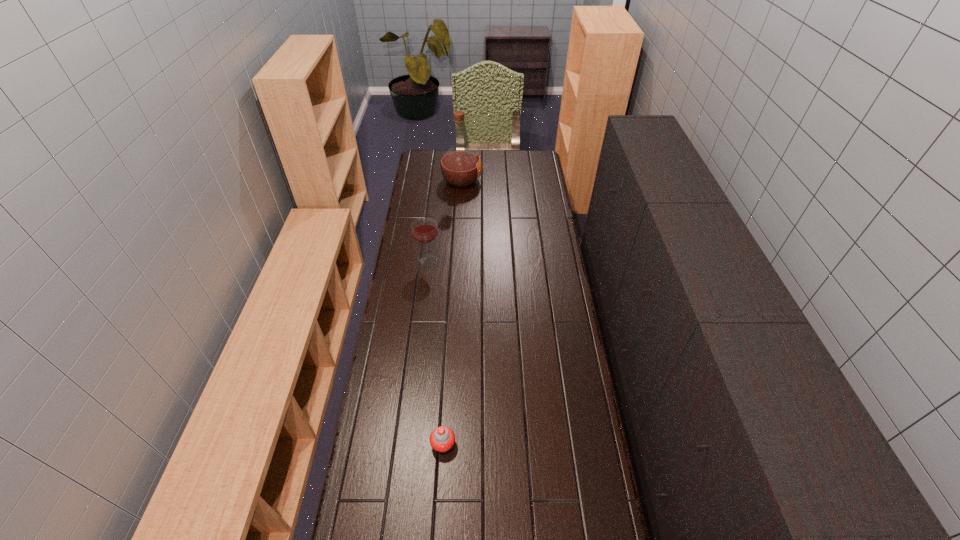
At what (x,y) coordinates should I click in order to perform the action: click on free spot between the nearest object and the liquor. Please return your answer as a coordinate pair (x, y). The width and height of the screenshot is (960, 540). Looking at the image, I should click on point(452,312).

Locate an element on the screen. This screenshot has height=540, width=960. free space between the wineglass and the tallest object is located at coordinates (444, 220).

This screenshot has width=960, height=540. I want to click on vacant region between the second nearest object and the liquor, so click(x=444, y=220).

Select which object appears as the second closest to the second shortest object. Please provide its 2D coordinates. Your answer should be formatted as a tuple, i.e. [(x, y)], where the tuple contains the x and y coordinates of a point satisfying the conditions above.

[(442, 439)]

Identify which object is the nearest to the farthest object. Please provide its 2D coordinates. Your answer should be formatted as a tuple, i.e. [(x, y)], where the tuple contains the x and y coordinates of a point satisfying the conditions above.

[(424, 230)]